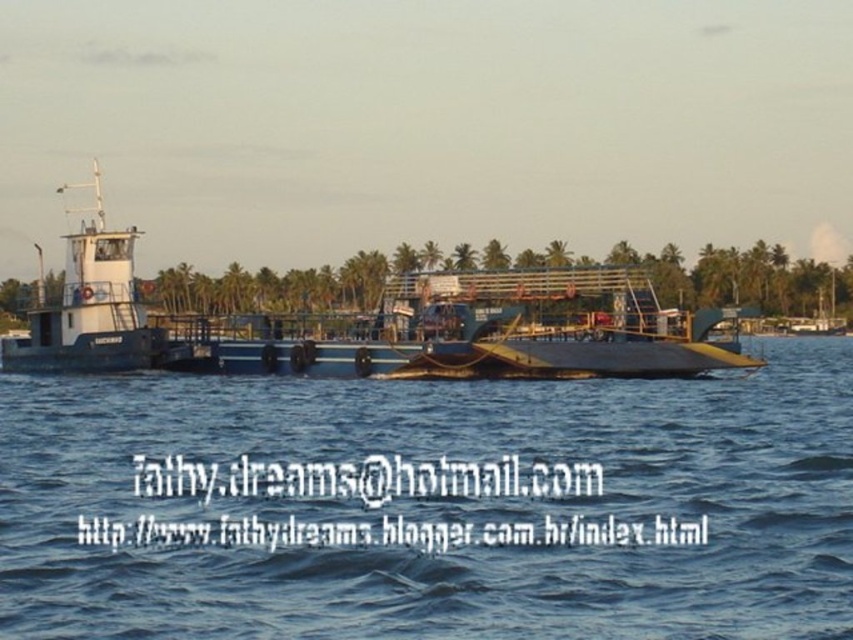
You are standing on the ferry boat and looking out. Where is the blue water at center located in terms of coordinates?

The blue water at center is located at coordinates point (442, 506).